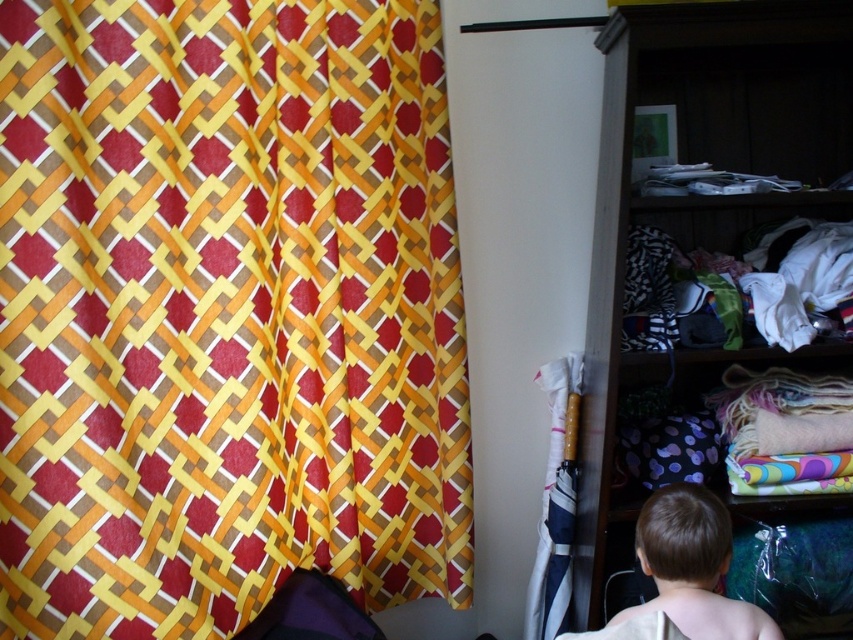
You are standing in the room corner where the colorful curtain is on the left. You notice a point marked at coordinates (x=692, y=566). What is located at that point?

The point at coordinates (x=692, y=566) indicates light brown hair at lower right.